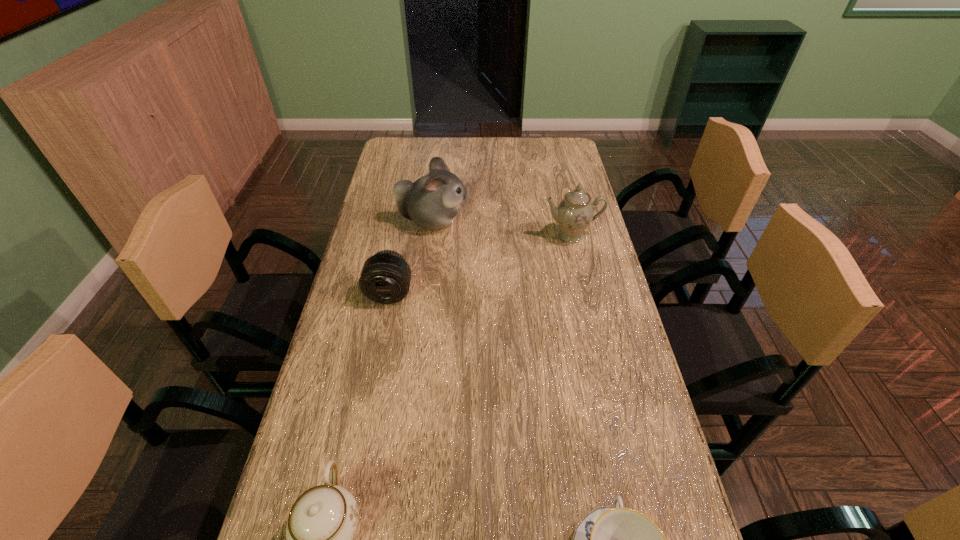
Locate an element on the screen. Image resolution: width=960 pixels, height=540 pixels. hamster is located at coordinates (432, 201).

You are a GUI agent. You are given a task and a screenshot of the screen. Output one action in this format:
    pyautogui.click(x=<x>, y=<y>)
    Task: Click on the tallest chinaware
    
    Given the screenshot: What is the action you would take?
    pyautogui.click(x=574, y=213)

Identify the location of telephoto lens. (385, 278).

Locate an element on the screen. This screenshot has width=960, height=540. vacant space located on the face of the hamster is located at coordinates (492, 221).

The image size is (960, 540). Identify the location of free space located on the spout of the farthest chinaware. (587, 308).

Identify the location of blank space located on the front-facing side of the third nearest object. (367, 409).

The image size is (960, 540). What are the coordinates of `hamster that is positioned at the left edge` in the screenshot? It's located at (432, 201).

Find the location of a particular element. This screenshot has width=960, height=540. telephoto lens located in the left edge section of the desktop is located at coordinates (385, 278).

Locate an element on the screen. Image resolution: width=960 pixels, height=540 pixels. object located in the right edge section of the desktop is located at coordinates (574, 213).

Locate an element on the screen. The height and width of the screenshot is (540, 960). vacant space at the far edge is located at coordinates (434, 152).